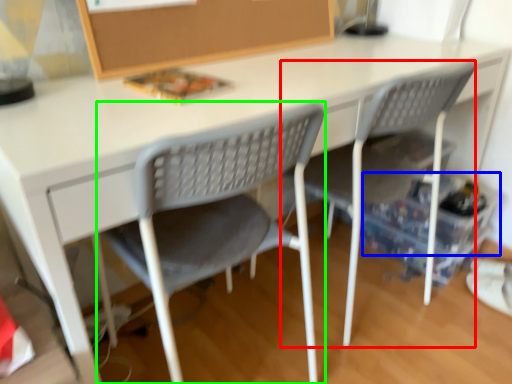
Question: Considering the real-world distances, which object is farthest from chair (highlighted by a red box)? storage box (highlighted by a blue box) or chair (highlighted by a green box)?

Choices:
 (A) storage box
 (B) chair

Answer: (B)